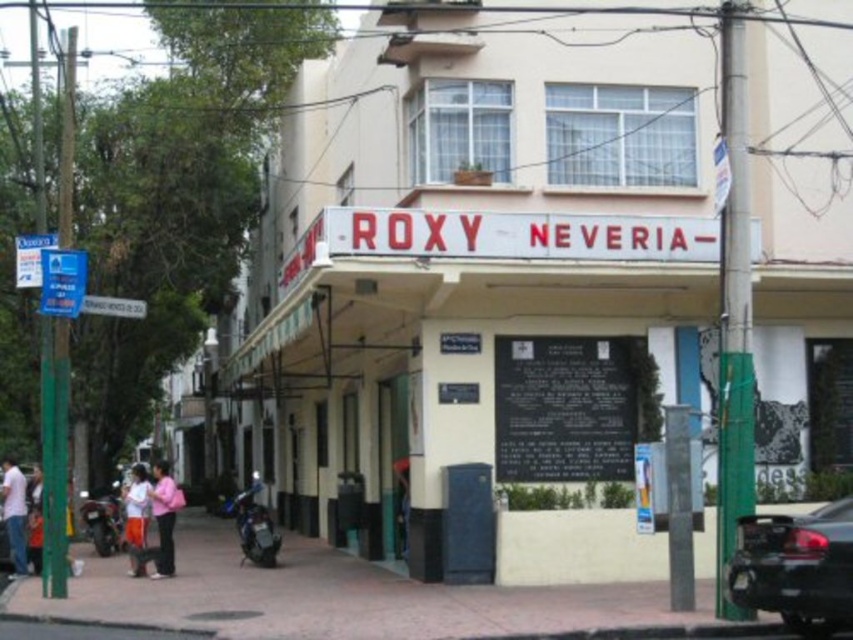
You are a photographer trying to capture the ROXY NEVERIA building sign. You notice a shiny black car at lower right and light blue jeans at lower left in your frame. Which object should you move closer to ensure the building sign remains fully visible in your photo?

The shiny black car at lower right is much taller than the light blue jeans at lower left. To keep the building sign visible, you should move closer to the light blue jeans at lower left since it is shorter and less likely to block the view of the sign.

You are a tourist standing on the sidewalk in front of the ROXY NEVERIA building. You see a black polished stone plaque at center and a pink fabric at lower left. Which object is positioned to the right of the other?

The black polished stone plaque at center is to the right of the pink fabric at lower left.

You are standing at the center of the street scene and want to locate the shiny black car at lower right. According to the coordinates provided, where exactly is it positioned?

The shiny black car at lower right is positioned at point [796,566].